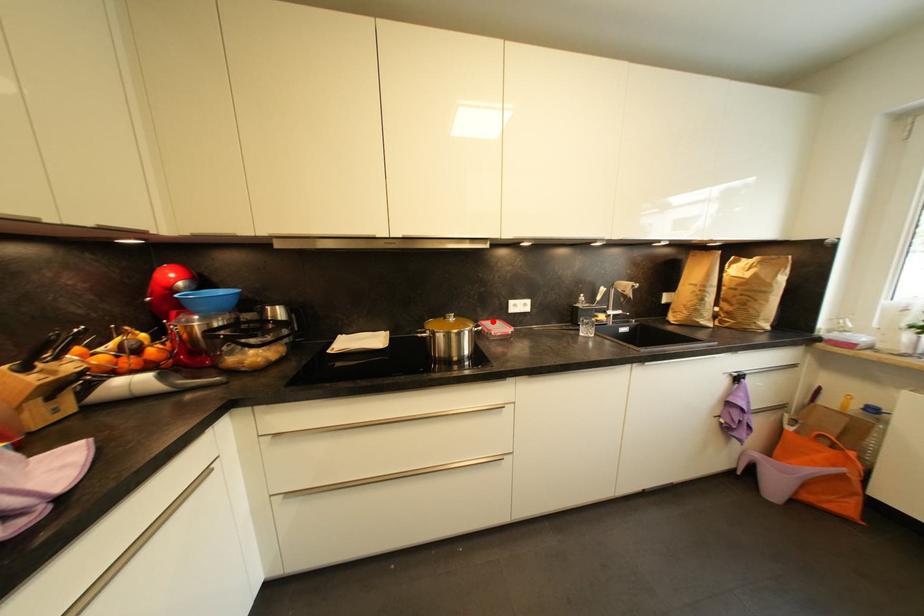
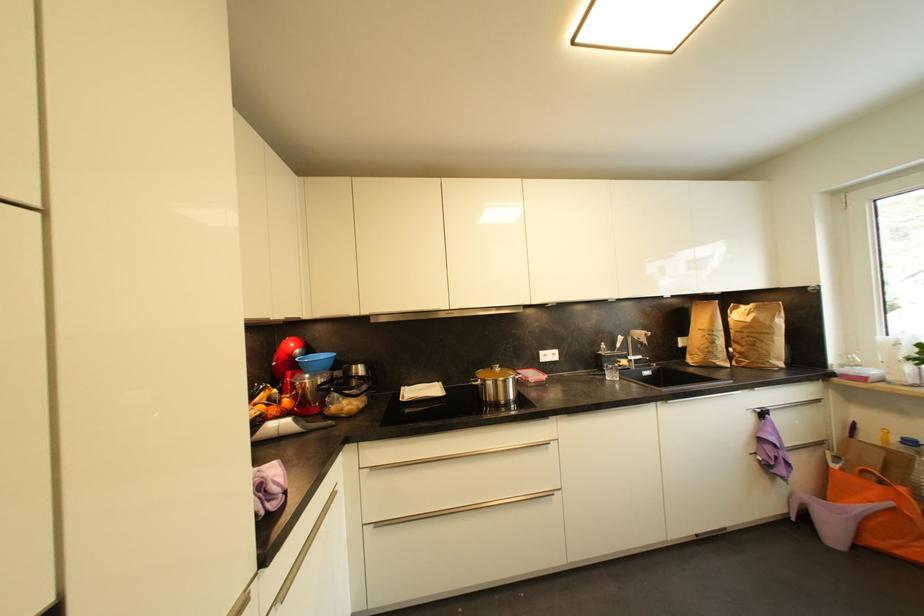
The point at the highlighted location is marked in the first image. Where is the corresponding point in the second image?

(528, 371)